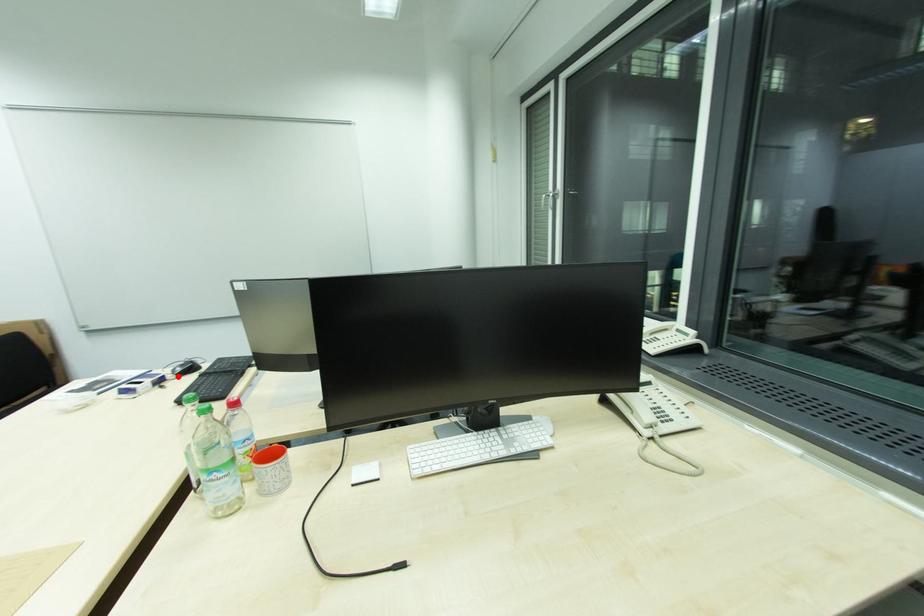
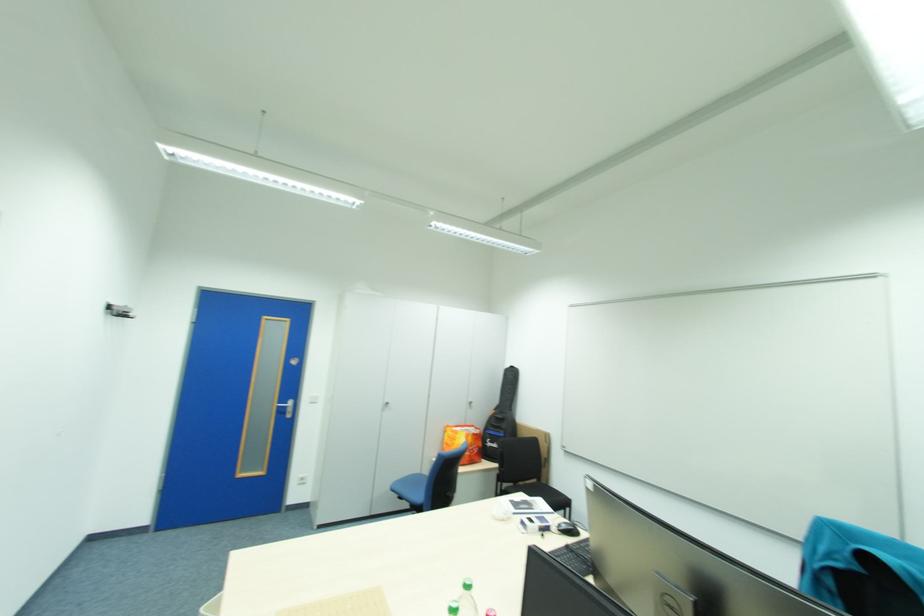
In the second image, find the point that corresponds to the highlighted location in the first image.

(563, 529)